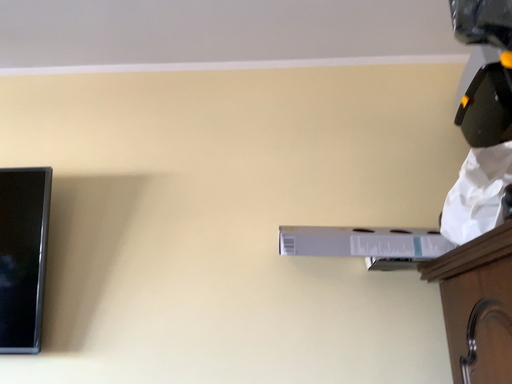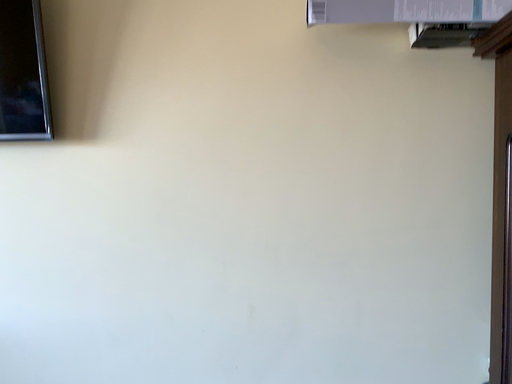
Question: Which way did the camera rotate in the video?

Choices:
 (A) rotated upward
 (B) rotated downward

Answer: (B)